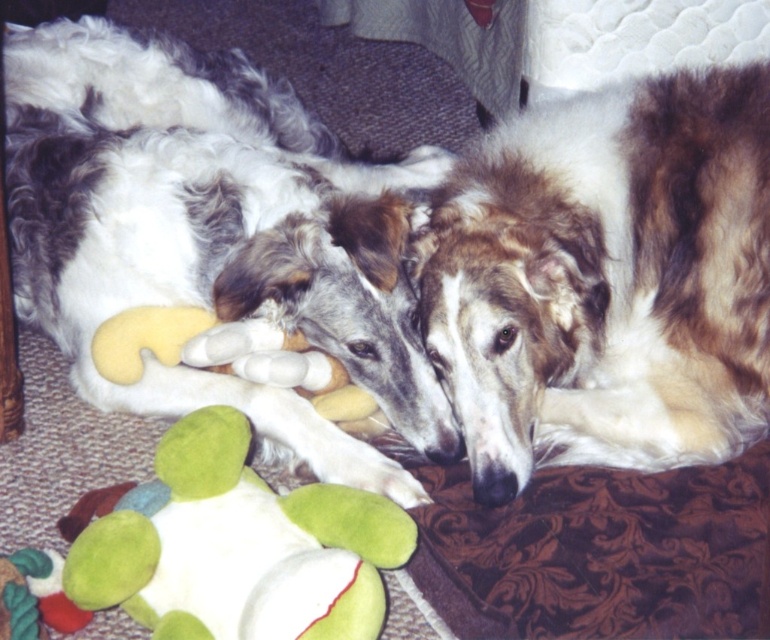
Can you confirm if soft plush dog at center is positioned to the right of green plush toy at center?

Incorrect, soft plush dog at center is not on the right side of green plush toy at center.

Based on the photo, who is positioned more to the right, soft plush dog at center or green plush toy at center?

From the viewer's perspective, green plush toy at center appears more on the right side.

The height and width of the screenshot is (640, 770). Describe the element at coordinates (213, 232) in the screenshot. I see `soft plush dog at center` at that location.

At what (x,y) coordinates should I click in order to perform the action: click on soft plush dog at center. Please return your answer as a coordinate pair (x, y). This screenshot has height=640, width=770. Looking at the image, I should click on (213, 232).

Is brown shaggy dog at center to the right of green plush toy at center from the viewer's perspective?

Correct, you'll find brown shaggy dog at center to the right of green plush toy at center.

Is the position of brown shaggy dog at center less distant than that of green plush toy at center?

No.

In order to click on brown shaggy dog at center in this screenshot , I will do `click(606, 280)`.

Can you confirm if soft plush dog at center is positioned below brown shaggy dog at center?

Actually, soft plush dog at center is above brown shaggy dog at center.

Between soft plush dog at center and brown shaggy dog at center, which one appears on the left side from the viewer's perspective?

soft plush dog at center

Is point (12, 138) farther from viewer compared to point (481, 154)?

That is True.

Where is `soft plush dog at center`? The image size is (770, 640). soft plush dog at center is located at coordinates (213, 232).